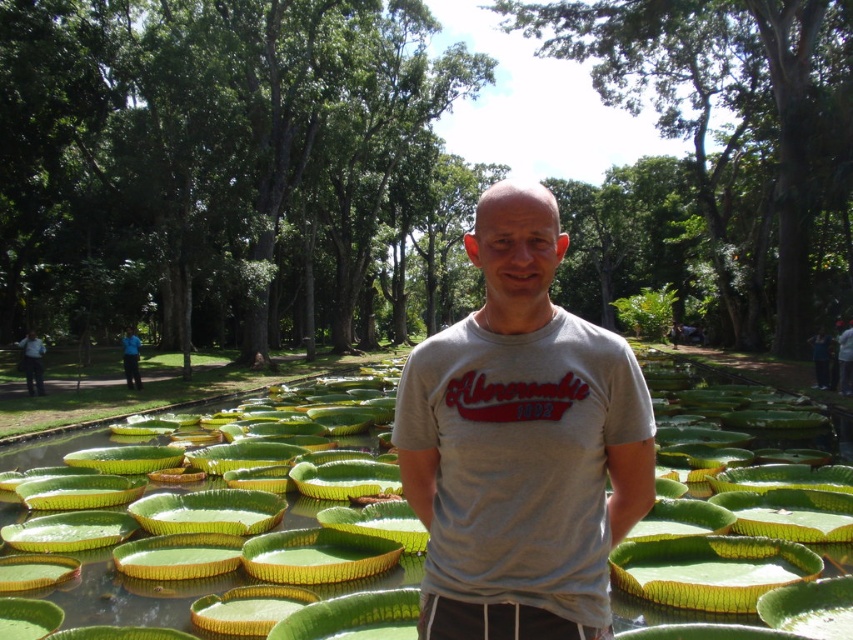
You are a photographer trying to capture the man in the gray cotton t shirt at center. The camera is positioned at the point with coordinates [521,444]. Can you determine if the camera is positioned directly in front of the gray cotton t shirt at center?

The point at coordinates [521,444] indicates the gray cotton t shirt at center, so the camera is positioned directly in front of the gray cotton t shirt at center.